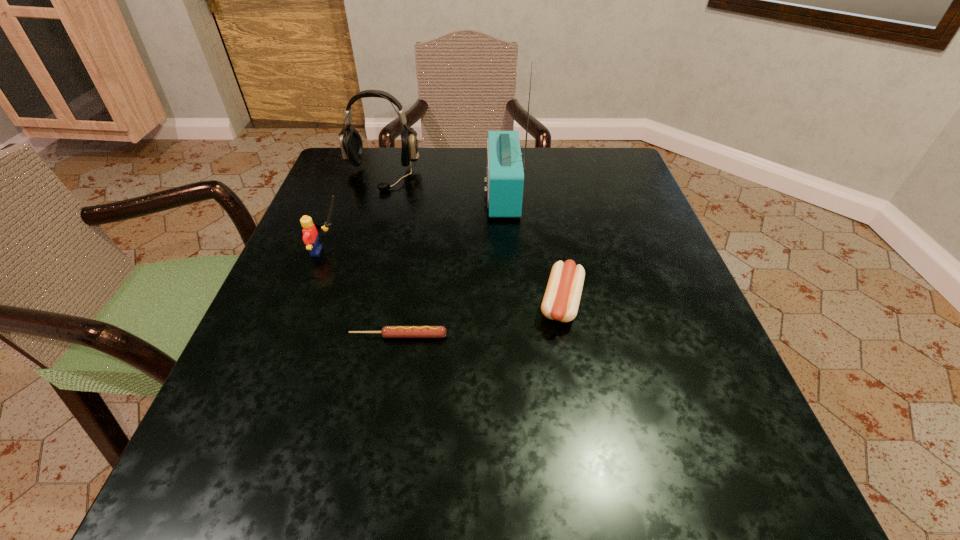
Identify the location of sausage at the left edge. (387, 331).

Image resolution: width=960 pixels, height=540 pixels. I want to click on object located at the far left corner, so click(351, 145).

Image resolution: width=960 pixels, height=540 pixels. I want to click on vacant space at the far edge of the desktop, so click(x=528, y=191).

Identify the location of free space at the near edge. (333, 492).

The height and width of the screenshot is (540, 960). What are the coordinates of `free space at the left edge of the desktop` in the screenshot? It's located at (326, 237).

Locate an element on the screen. The image size is (960, 540). vacant space at the right edge of the desktop is located at coordinates tap(642, 238).

The width and height of the screenshot is (960, 540). What are the coordinates of `vacant space at the far left corner of the desktop` in the screenshot? It's located at (336, 166).

Identify the location of free region at the far right corner of the desktop. This screenshot has height=540, width=960. (610, 187).

Locate an element on the screen. The image size is (960, 540). vacant area that lies between the headset and the third farthest object is located at coordinates (354, 213).

Where is `free spot between the taller sausage and the headset`? free spot between the taller sausage and the headset is located at coordinates (471, 239).